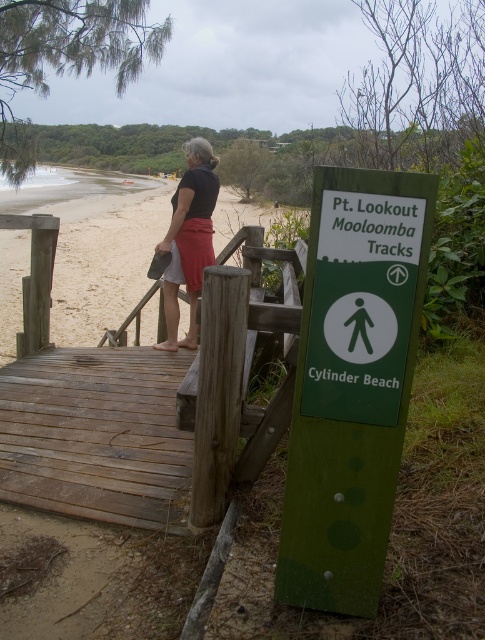
What is the position of the green matte sign at center relative to the matte black shirt at center?

The green matte sign at center is to the right of the matte black shirt at center.

You are standing on the wooden boardwalk and want to reach the sandy beach at left. Is the green matte sign at center between you and the beach?

The green matte sign at center is closer to the viewer than the sandy beach at left, so yes, the green matte sign at center is between you and the sandy beach at left.

You are a photographer standing on the boardwalk and want to take a photo of the green matte sign at center and the matte black shirt at center. Which object is shorter in the image?

The green matte sign at center is not as tall as the matte black shirt at center, so the green matte sign at center is shorter.